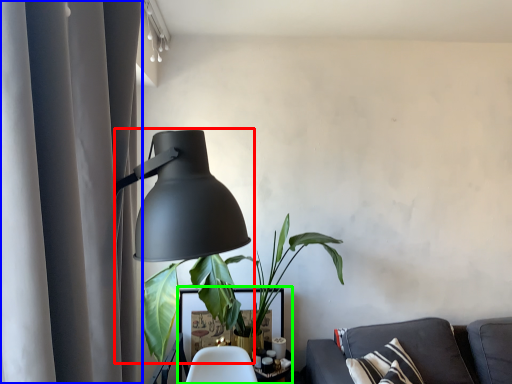
Question: Which object is the farthest from lamp (highlighted by a red box)? Choose among these: curtain (highlighted by a blue box) or table (highlighted by a green box).

Choices:
 (A) curtain
 (B) table

Answer: (A)